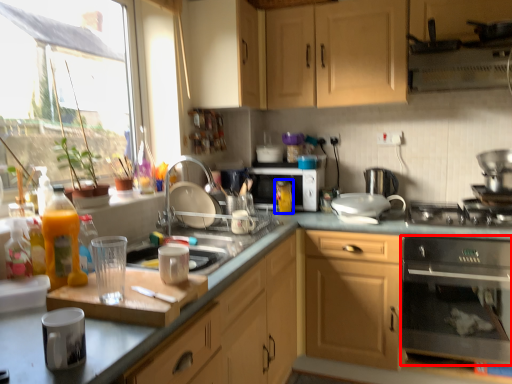
Question: Which object is further to the camera taking this photo, kitchen appliance (highlighted by a red box) or bottle (highlighted by a blue box)?

Choices:
 (A) kitchen appliance
 (B) bottle

Answer: (B)